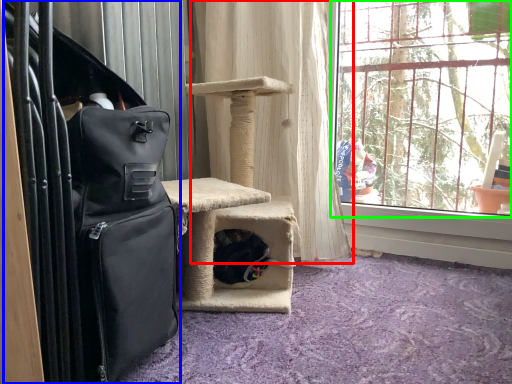
Question: Which is nearer to the curtain (highlighted by a red box)? luggage (highlighted by a blue box) or window (highlighted by a green box).

Choices:
 (A) luggage
 (B) window

Answer: (B)